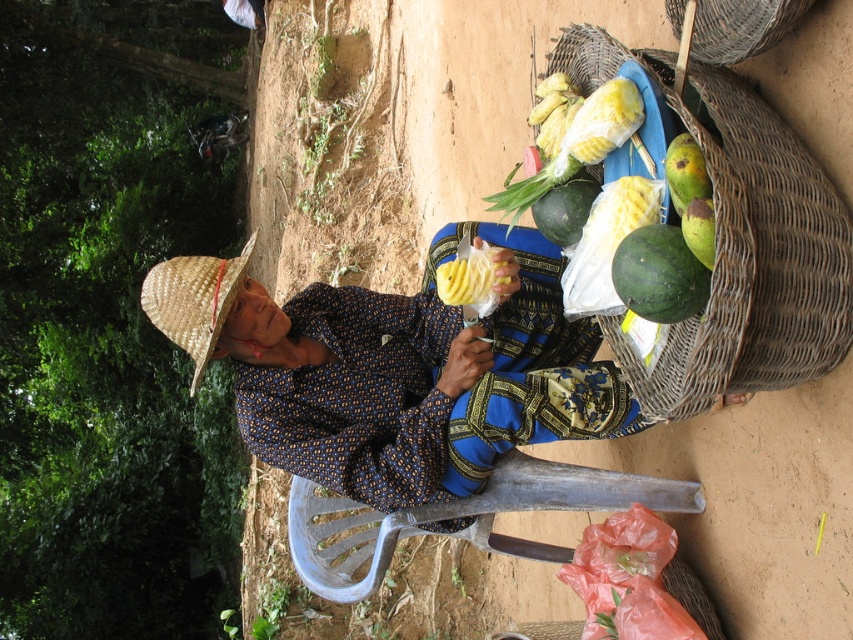
You are a customer at the market and want to buy the pineapple from the seller. Where is the seller located relative to the straw hat at left?

The seller is located to the right of the straw hat at left because the seller is holding the pineapple, which is part of their produce display, and the hat is positioned at the left side.

You are a customer at the produce stand and want to buy the widest fruit between the yellow matte pineapple at center and the green matte mango at upper right. Which one should you choose?

The yellow matte pineapple at center is wider than the green matte mango at upper right, so you should choose the yellow matte pineapple at center.

You are a customer approaching the vendor to buy some fruits. You see the straw hat at left and the woven bamboo basket at upper right. Which item will you encounter first as you walk towards the vendor?

The straw hat at left will be encountered first because it is closer to you than the woven bamboo basket at upper right, which is further away.